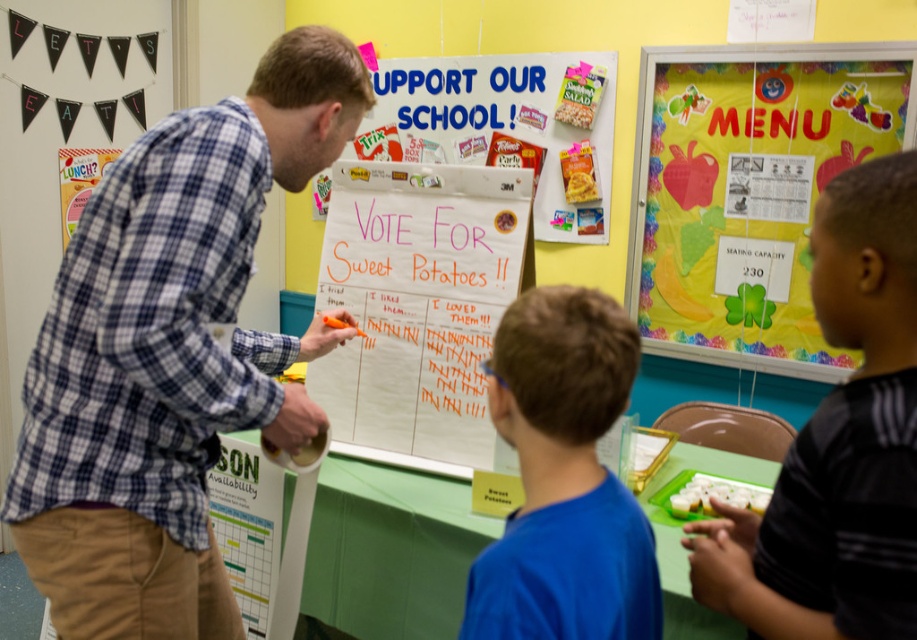
Is blue plaid shirt at center closer to camera compared to colorful paper menu at upper right?

Yes, it is in front of colorful paper menu at upper right.

Consider the image. Is blue plaid shirt at center bigger than colorful paper menu at upper right?

Indeed, blue plaid shirt at center has a larger size compared to colorful paper menu at upper right.

Describe the element at coordinates (170, 353) in the screenshot. Image resolution: width=917 pixels, height=640 pixels. I see `blue plaid shirt at center` at that location.

At what (x,y) coordinates should I click in order to perform the action: click on blue plaid shirt at center. Please return your answer as a coordinate pair (x, y). The height and width of the screenshot is (640, 917). Looking at the image, I should click on (170, 353).

Which is more to the right, blue plaid shirt at center or green paper poster at lower left?

Positioned to the right is blue plaid shirt at center.

Can you confirm if blue plaid shirt at center is taller than green paper poster at lower left?

Yes.

Describe the element at coordinates (170, 353) in the screenshot. I see `blue plaid shirt at center` at that location.

Locate an element on the screen. This screenshot has width=917, height=640. blue plaid shirt at center is located at coordinates (170, 353).

Can you confirm if blue shirt at center is smaller than orange marker board at center?

Correct, blue shirt at center occupies less space than orange marker board at center.

Where is `blue shirt at center`? Image resolution: width=917 pixels, height=640 pixels. blue shirt at center is located at coordinates (564, 480).